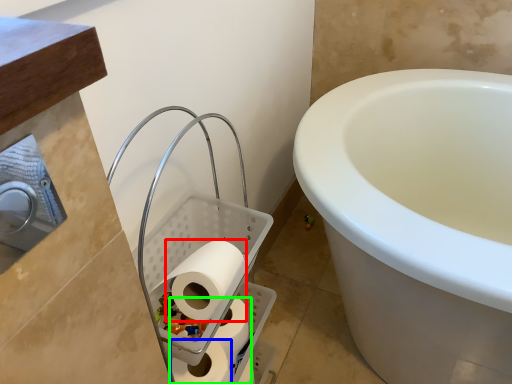
Question: Which object is the farthest from toilet paper (highlighted by a red box)? Choose among these: toilet paper (highlighted by a blue box) or toilet paper (highlighted by a green box).

Choices:
 (A) toilet paper
 (B) toilet paper

Answer: (B)